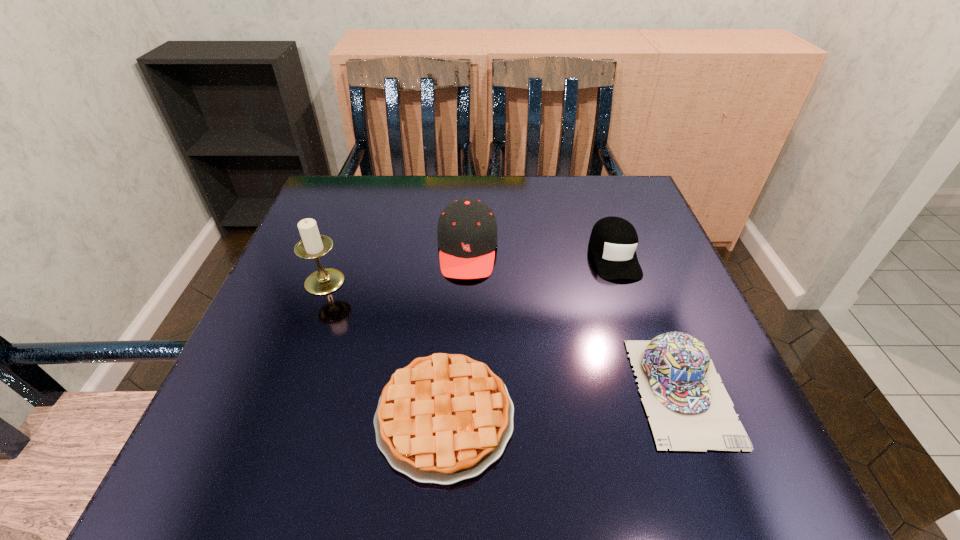
Locate an element on the screen. vacant area that lies between the shortest object and the tallest cap is located at coordinates (456, 333).

Find the location of a particular element. free spot between the leftmost object and the tallest cap is located at coordinates [396, 266].

This screenshot has height=540, width=960. I want to click on vacant region between the shortest object and the leftmost cap, so click(x=456, y=333).

At what (x,y) coordinates should I click in order to perform the action: click on vacant space that is in between the tallest cap and the pie. Please return your answer as a coordinate pair (x, y). Looking at the image, I should click on (456, 333).

Image resolution: width=960 pixels, height=540 pixels. I want to click on vacant area that lies between the pie and the leftmost object, so click(x=385, y=349).

Image resolution: width=960 pixels, height=540 pixels. What are the coordinates of `free space between the nearest cap and the tallest cap` in the screenshot? It's located at (575, 321).

Select which object appears as the third closest to the nearest cap. Please provide its 2D coordinates. Your answer should be formatted as a tuple, i.e. [(x, y)], where the tuple contains the x and y coordinates of a point satisfying the conditions above.

[(467, 238)]

Locate which object is the closest to the fourth shortest object. Please provide its 2D coordinates. Your answer should be formatted as a tuple, i.e. [(x, y)], where the tuple contains the x and y coordinates of a point satisfying the conditions above.

[(313, 245)]

Locate which cap is the third closest to the leftmost object. Please provide its 2D coordinates. Your answer should be formatted as a tuple, i.e. [(x, y)], where the tuple contains the x and y coordinates of a point satisfying the conditions above.

[(690, 410)]

Locate which cap is the closest to the nearest cap. Please provide its 2D coordinates. Your answer should be formatted as a tuple, i.e. [(x, y)], where the tuple contains the x and y coordinates of a point satisfying the conditions above.

[(613, 241)]